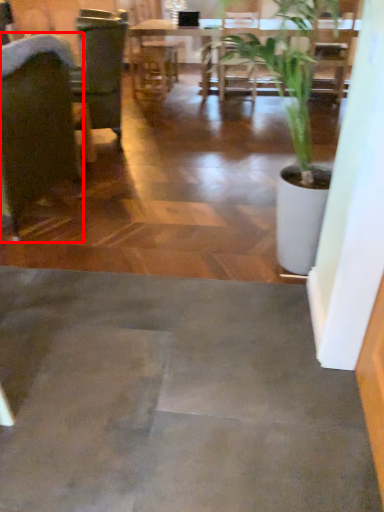
Question: Considering the relative positions of chair (annotated by the red box) and table in the image provided, where is chair (annotated by the red box) located with respect to the staircase?

Choices:
 (A) right
 (B) left

Answer: (B)